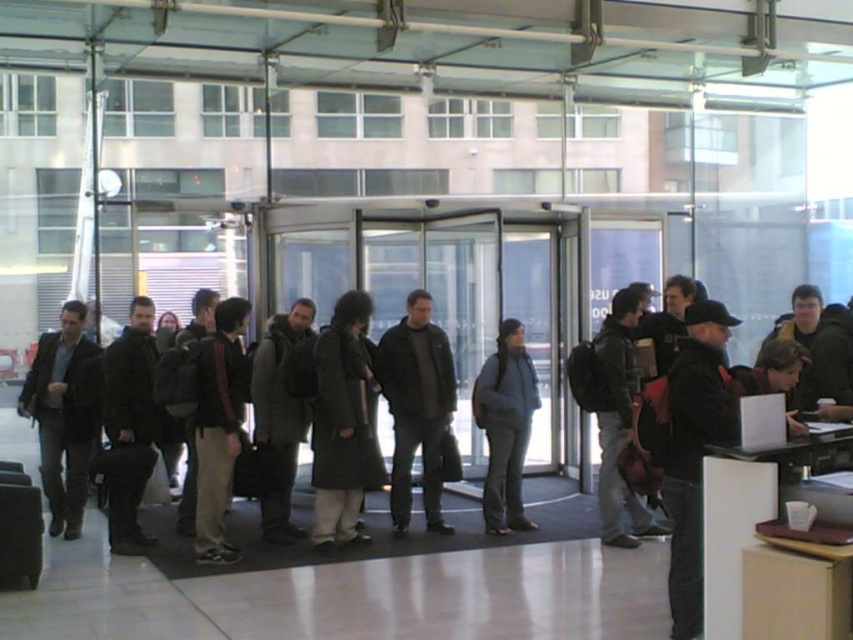
Question: Among these points, which one is nearest to the camera?

Choices:
 (A) (335, 515)
 (B) (421, 342)
 (C) (488, 529)

Answer: (A)

Question: Which of the following is the closest to the observer?

Choices:
 (A) (509, 490)
 (B) (334, 413)

Answer: (B)

Question: Which point is closer to the camera taking this photo?

Choices:
 (A) (138, 502)
 (B) (322, 342)

Answer: (B)

Question: Is dark gray leather jacket at center behind dark brown leather jacket at center?

Choices:
 (A) no
 (B) yes

Answer: (B)

Question: Does gray wool coat at center have a larger size compared to dark brown leather jacket at center?

Choices:
 (A) no
 (B) yes

Answer: (A)

Question: From the image, what is the correct spatial relationship of dark gray coat at center in relation to gray wool coat at center?

Choices:
 (A) above
 (B) below

Answer: (A)